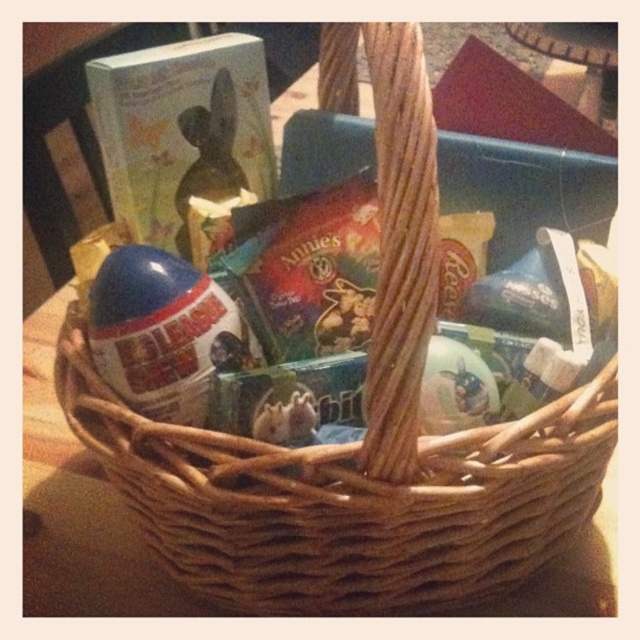
You are holding a small toy rabbit and want to place it in the Easter basket. The basket has two specific spots marked by coordinates. The first spot is at point (234,328) and the second is at point (188,230). Which coordinate point is closer to you when looking at the basket?

Point (234,328) is closer to the camera than point (188,230), so you should place the toy rabbit at that coordinate point since it is nearer to your current position.

From the picture: You are holding a small toy car that you want to place between the blue plastic egg at center and the shiny plastic bunny at center in the Easter basket. Can you fit it there without moving either object?

The blue plastic egg at center is closer to the viewer than the shiny plastic bunny at center, so there is space between them. You can fit the toy car there without moving either object.

You are organizing an Easter basket and need to place a 6.5 inch wide ribbon between the blue plastic egg at center and the shiny plastic bunny at center. Will the ribbon fit between them?

The blue plastic egg at center is 7.43 inches away from the shiny plastic bunny at center. Since the ribbon is 6.5 inches wide, it will fit between them with some space remaining.